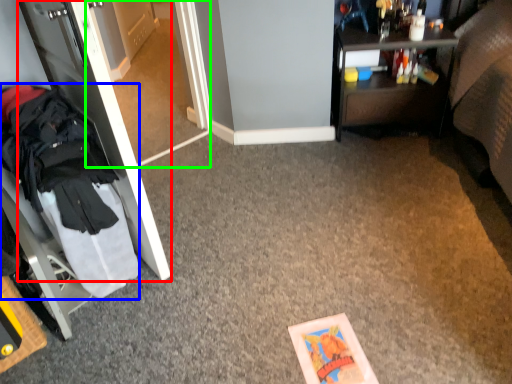
Question: Which object is the farthest from door (highlighted by a red box)? Choose among these: clothing (highlighted by a blue box) or glass door (highlighted by a green box).

Choices:
 (A) clothing
 (B) glass door

Answer: (B)